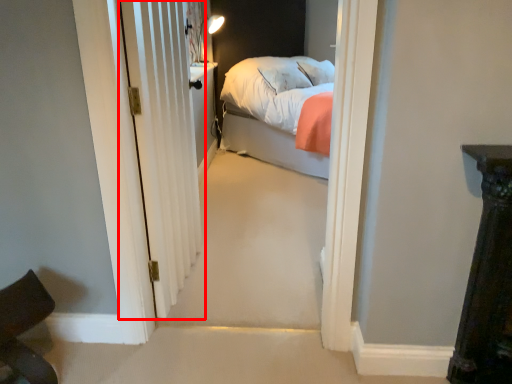
Question: From the image's perspective, where is door (annotated by the red box) located in relation to chair in the image?

Choices:
 (A) above
 (B) below

Answer: (A)